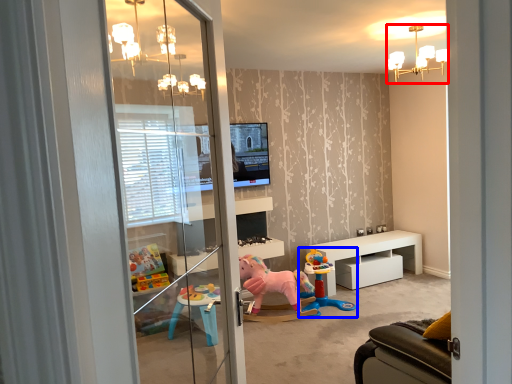
Question: Which of the following is the closest to the observer, light fixture (highlighted by a red box) or toy (highlighted by a blue box)?

Choices:
 (A) light fixture
 (B) toy

Answer: (A)